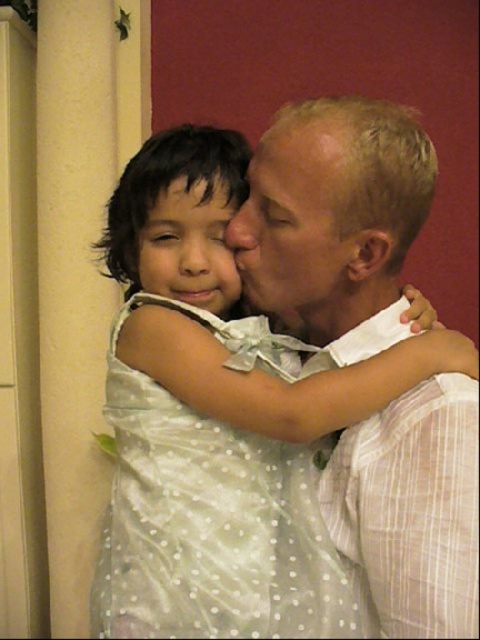
Is white dotted dress at center above smooth skin face at center?

Incorrect, white dotted dress at center is not positioned above smooth skin face at center.

Does white dotted dress at center appear under smooth skin face at center?

Yes, white dotted dress at center is below smooth skin face at center.

Which is behind, point (183, 451) or point (313, 301)?

Positioned behind is point (313, 301).

Find the location of a particular element. This screenshot has width=480, height=640. white dotted dress at center is located at coordinates (219, 417).

Between smooth skin face at center and matte white dress at center, which one has less height?

matte white dress at center is shorter.

Which is behind, point (312, 241) or point (145, 227)?

Positioned behind is point (145, 227).

In order to click on smooth skin face at center in this screenshot , I will do `click(291, 220)`.

Does point (191, 547) lie behind point (230, 202)?

No.

Can you confirm if white dotted dress at center is taller than matte white dress at center?

Yes.

Based on the photo, who is more forward, [310,612] or [147,262]?

Point [310,612]

Locate an element on the screen. This screenshot has height=640, width=480. white dotted dress at center is located at coordinates (219, 417).